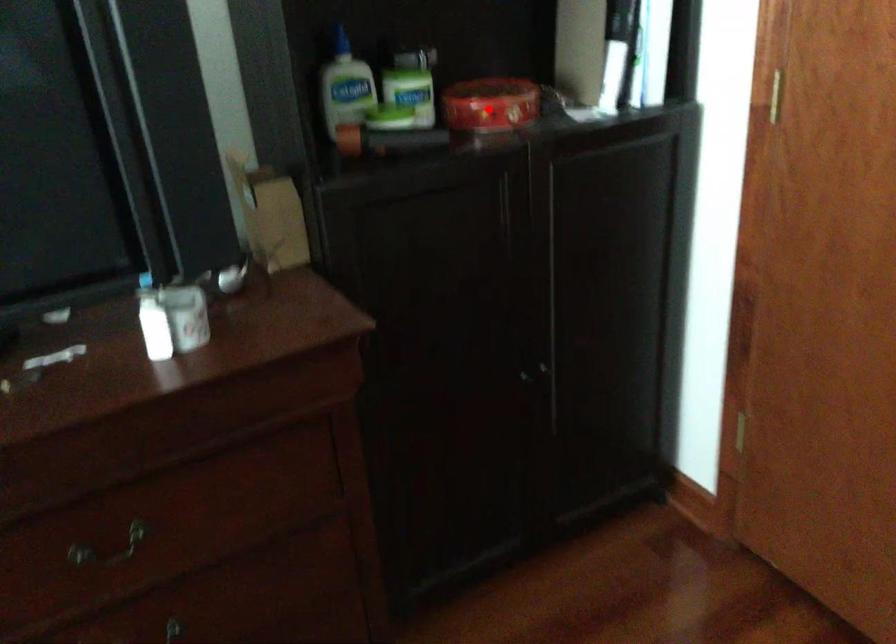
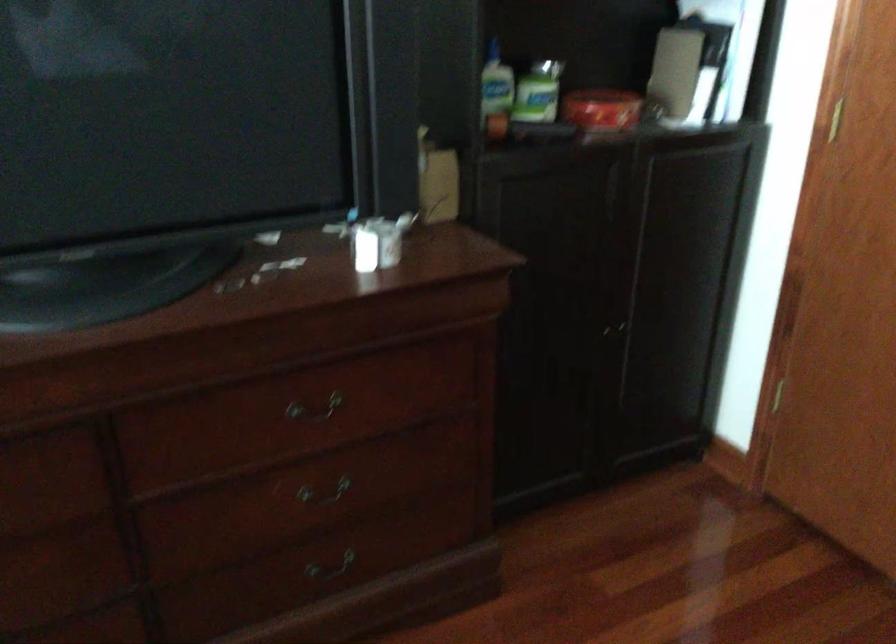
Locate, in the second image, the point that corresponds to the highlighted location in the first image.

(600, 109)